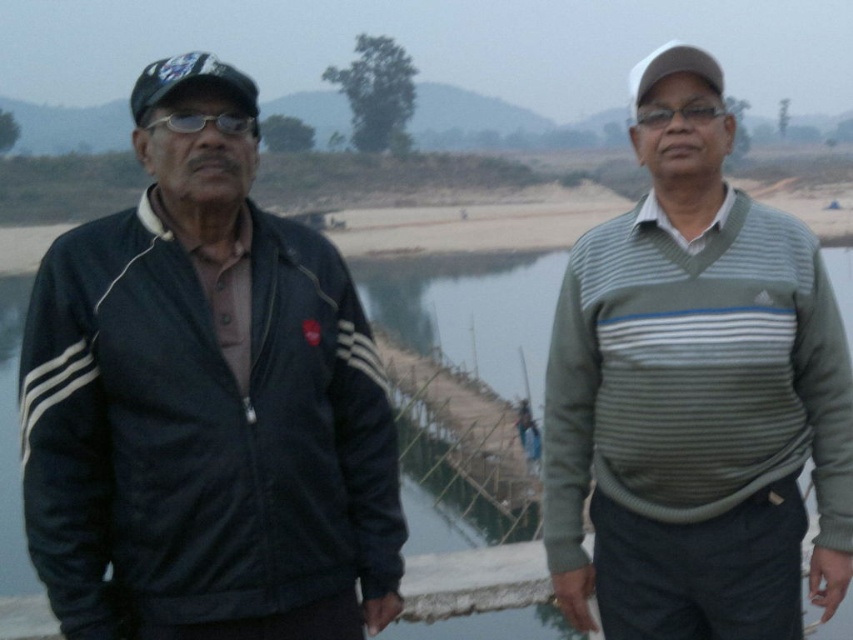
Question: Based on their relative distances, which object is nearer to the matte black jacket at left?

Choices:
 (A) striped sweater at center
 (B) black matte glasses at left
 (C) greenish water at center

Answer: (B)

Question: Does matte black jacket at left have a smaller size compared to black matte glasses at left?

Choices:
 (A) no
 (B) yes

Answer: (A)

Question: Estimate the real-world distances between objects in this image. Which object is farther from the greenish water at center?

Choices:
 (A) black matte glasses at left
 (B) striped sweater at center

Answer: (B)

Question: Does matte black jacket at left lie in front of greenish water at center?

Choices:
 (A) no
 (B) yes

Answer: (B)

Question: Is matte black jacket at left closer to camera compared to black matte glasses at left?

Choices:
 (A) yes
 (B) no

Answer: (A)

Question: Among these points, which one is nearest to the camera?

Choices:
 (A) (660, 188)
 (B) (474, 326)
 (C) (196, 131)

Answer: (C)